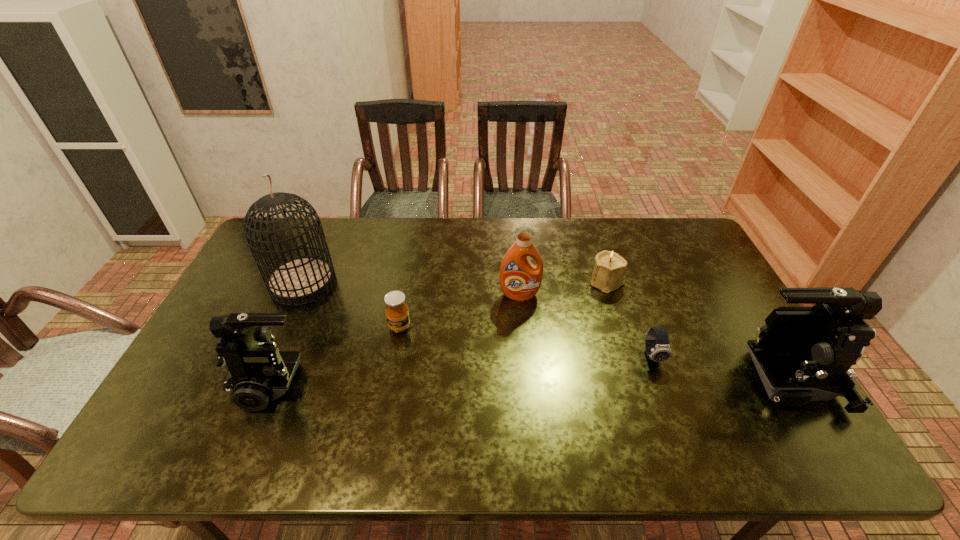
Where is `vacant space located on the lens mount of the left camcorder`? The width and height of the screenshot is (960, 540). vacant space located on the lens mount of the left camcorder is located at coordinates (214, 381).

You are a GUI agent. You are given a task and a screenshot of the screen. Output one action in this format:
    pyautogui.click(x=<x>, y=<y>)
    Task: Click on the blank area located on the right of the candle_holder
    The image size is (960, 540).
    Given the screenshot: What is the action you would take?
    click(686, 282)

The image size is (960, 540). Find the location of `free space located on the front-facing side of the honey`. free space located on the front-facing side of the honey is located at coordinates (386, 406).

Where is `vacant space located on the right of the tallest object`? Image resolution: width=960 pixels, height=540 pixels. vacant space located on the right of the tallest object is located at coordinates (385, 283).

Where is `vacant space located on the face of the watch`? This screenshot has width=960, height=540. vacant space located on the face of the watch is located at coordinates (673, 411).

Find the location of a particular element. The height and width of the screenshot is (540, 960). vacant space situated 0.190m on the front-facing side of the detergent is located at coordinates (525, 349).

The image size is (960, 540). I want to click on camcorder present at the left edge, so click(x=258, y=372).

The width and height of the screenshot is (960, 540). What are the coordinates of `birdcage that is at the left edge` in the screenshot? It's located at (298, 281).

You are a GUI agent. You are given a task and a screenshot of the screen. Output one action in this format:
    pyautogui.click(x=<x>, y=<y>)
    Task: Click on the object situated at the right edge
    This screenshot has width=960, height=540.
    Given the screenshot: What is the action you would take?
    pyautogui.click(x=802, y=354)

You are a GUI agent. You are given a task and a screenshot of the screen. Output one action in this format:
    pyautogui.click(x=<x>, y=<y>)
    Task: Click on the object located in the near left corner section of the desktop
    The image size is (960, 540).
    Given the screenshot: What is the action you would take?
    pyautogui.click(x=258, y=372)